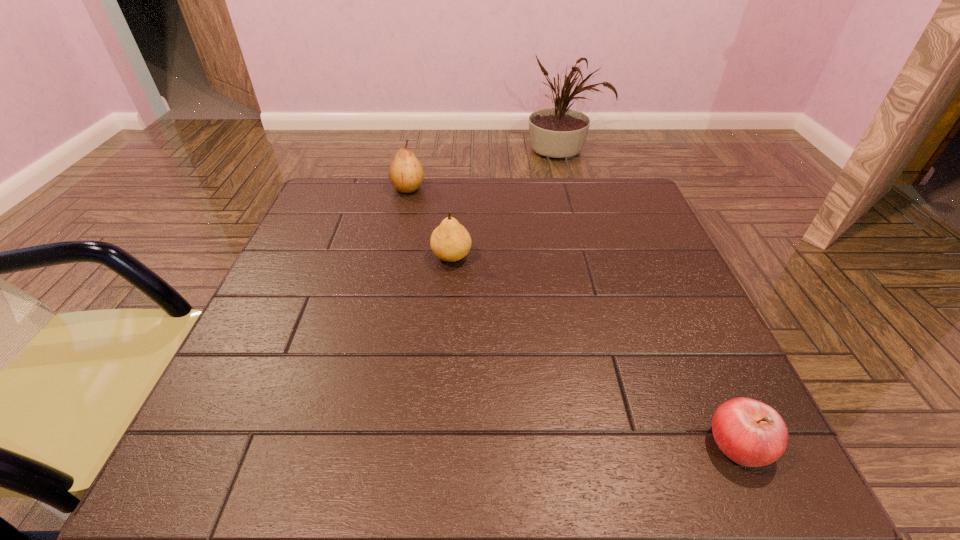
The image size is (960, 540). Find the location of `empty location between the farther pear and the second object from right to left`. empty location between the farther pear and the second object from right to left is located at coordinates (430, 222).

This screenshot has height=540, width=960. Identify the location of vacant area that lies between the shortest object and the second object from left to right. (595, 350).

Find the location of a particular element. The height and width of the screenshot is (540, 960). vacant area between the second object from left to right and the shortest object is located at coordinates (595, 350).

You are a GUI agent. You are given a task and a screenshot of the screen. Output one action in this format:
    pyautogui.click(x=<x>, y=<y>)
    Task: Click on the empty space that is in between the second object from right to left and the nearest object
    This screenshot has height=540, width=960.
    Given the screenshot: What is the action you would take?
    pyautogui.click(x=595, y=350)

You are a GUI agent. You are given a task and a screenshot of the screen. Output one action in this format:
    pyautogui.click(x=<x>, y=<y>)
    Task: Click on the blank region between the left pear and the shortest object
    This screenshot has height=540, width=960.
    Given the screenshot: What is the action you would take?
    pyautogui.click(x=573, y=316)

You are a GUI agent. You are given a task and a screenshot of the screen. Output one action in this format:
    pyautogui.click(x=<x>, y=<y>)
    Task: Click on the empty space between the right pear and the rightmost object
    This screenshot has width=960, height=540.
    Given the screenshot: What is the action you would take?
    pyautogui.click(x=595, y=350)

At what (x,y) coordinates should I click in order to perform the action: click on vacant space that's between the apple and the leftmost object. Please return your answer as a coordinate pair (x, y). Looking at the image, I should click on (573, 316).

I want to click on free space between the left pear and the nearest object, so coord(573,316).

Where is `free spot between the nearest object and the second nearest object`? Image resolution: width=960 pixels, height=540 pixels. free spot between the nearest object and the second nearest object is located at coordinates (595, 350).

Point out which object is positioned as the nearest to the right pear. Please provide its 2D coordinates. Your answer should be formatted as a tuple, i.e. [(x, y)], where the tuple contains the x and y coordinates of a point satisfying the conditions above.

[(406, 174)]